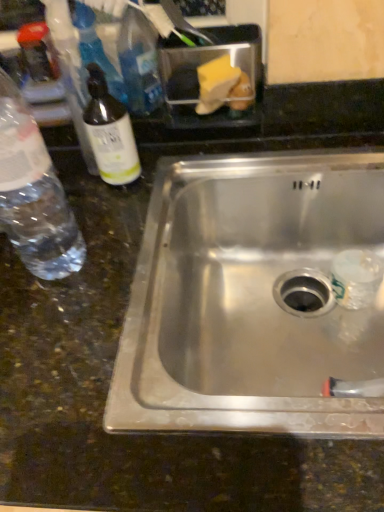
Question: Which is correct: clear glass bottle at left, acting as the second bottle starting from the left, is inside clear plastic bottle at left, which is the second bottle in right-to-left order, or outside of it?

Choices:
 (A) outside
 (B) inside

Answer: (A)

Question: From a real-world perspective, is clear glass bottle at left, acting as the second bottle starting from the left, physically located above or below clear plastic bottle at left, which is the second bottle in right-to-left order?

Choices:
 (A) below
 (B) above

Answer: (A)

Question: Which object is the farthest from the clear plastic bottle at left, the first bottle when ordered from left to right?

Choices:
 (A) clear glass bottle at left, which is the 1th bottle in right-to-left order
 (B) stainless steel sink at center

Answer: (B)

Question: Considering the real-world distances, which object is closest to the clear glass bottle at left, acting as the second bottle starting from the left?

Choices:
 (A) stainless steel sink at center
 (B) clear plastic bottle at left, the first bottle when ordered from left to right

Answer: (B)